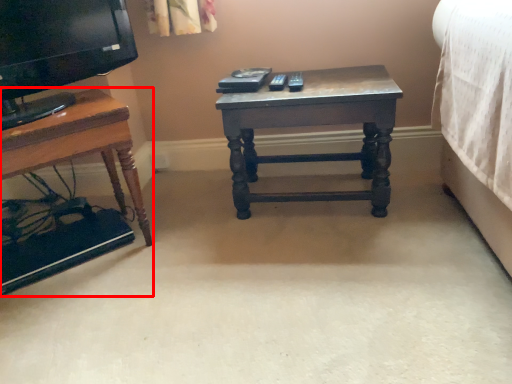
Question: From the image, what is the correct spatial relationship of table (annotated by the red box) in relation to table?

Choices:
 (A) left
 (B) right

Answer: (A)